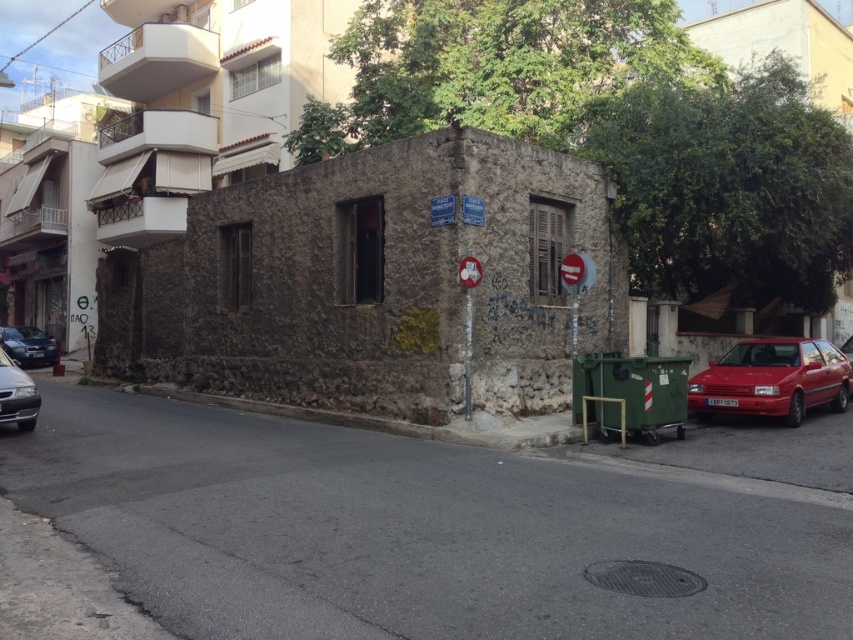
Can you confirm if shiny silver sedan at lower left is thinner than shiny black sedan at left?

Yes, shiny silver sedan at lower left is thinner than shiny black sedan at left.

Who is taller, shiny silver sedan at lower left or shiny black sedan at left?

With more height is shiny black sedan at left.

This screenshot has width=853, height=640. Find the location of `shiny silver sedan at lower left`. shiny silver sedan at lower left is located at coordinates (16, 394).

Between shiny red car at right and shiny silver sedan at lower left, which one is positioned higher?

shiny red car at right is higher up.

Which is in front, point (733, 349) or point (28, 380)?

Point (28, 380) is more forward.

Find the location of a particular element. The width and height of the screenshot is (853, 640). shiny red car at right is located at coordinates (772, 380).

In the scene shown: Who is taller, shiny red car at right or shiny black sedan at left?

Standing taller between the two is shiny red car at right.

Which is more to the right, shiny red car at right or shiny black sedan at left?

shiny red car at right is more to the right.

Find the location of `shiny red car at right`. shiny red car at right is located at coordinates (772, 380).

At what (x,y) coordinates should I click in order to perform the action: click on shiny red car at right. Please return your answer as a coordinate pair (x, y). The width and height of the screenshot is (853, 640). Looking at the image, I should click on (772, 380).